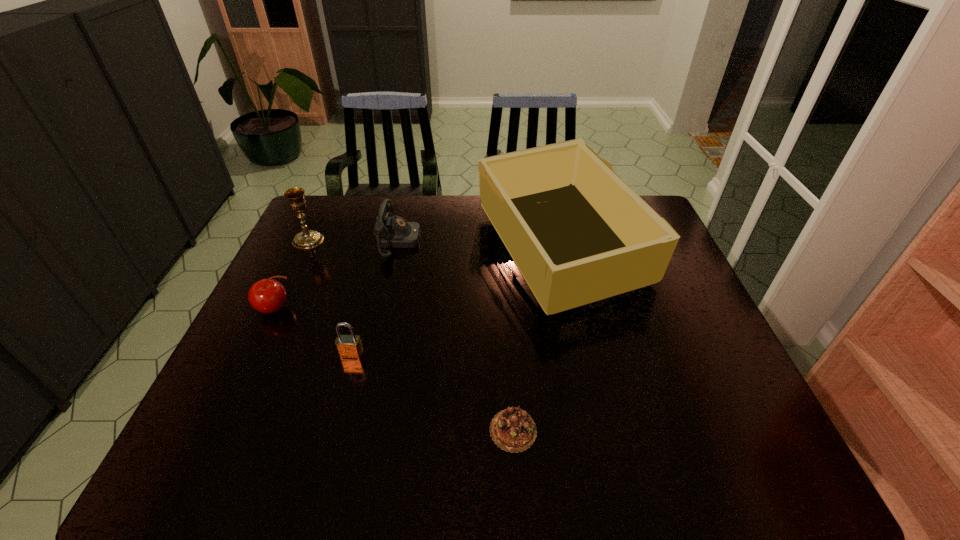
Where is `free space located on the front of the cherry`? free space located on the front of the cherry is located at coordinates (206, 457).

This screenshot has width=960, height=540. In order to click on vacant space located on the front of the padlock in this screenshot , I will do `click(333, 423)`.

You are a GUI agent. You are given a task and a screenshot of the screen. Output one action in this format:
    pyautogui.click(x=<x>, y=<y>)
    Task: Click on the free point located 0.340m on the back of the shortest object
    
    Given the screenshot: What is the action you would take?
    pyautogui.click(x=505, y=300)

This screenshot has height=540, width=960. In order to click on box that is positioned at the far edge in this screenshot , I will do tap(577, 233).

This screenshot has height=540, width=960. In order to click on chalice that is at the far edge in this screenshot , I will do `click(307, 239)`.

Locate an element on the screen. The height and width of the screenshot is (540, 960). telephone present at the far edge is located at coordinates (391, 232).

Identify the location of object that is at the near edge. (513, 430).

The image size is (960, 540). I want to click on chalice situated at the left edge, so click(x=307, y=239).

Where is `cherry located at the left edge`? cherry located at the left edge is located at coordinates (268, 296).

Image resolution: width=960 pixels, height=540 pixels. Identify the location of object at the right edge. (577, 233).